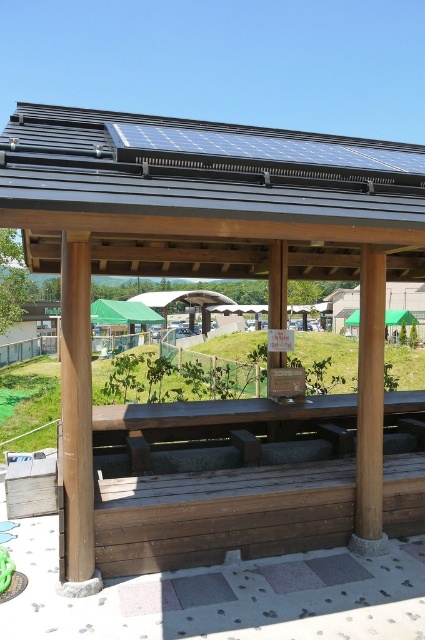
You are standing at the bus stop and want to check the distance between you and the black solar panel at upper center. Can you estimate if it is more than 3 meters?

The black solar panel at upper center is 3.01 meters from viewer, so yes, it is more than 3 meters away.

You are a maintenance worker checking the solar panels at the bus stop. You notice the black solar panel at upper center and the brown wood pillar at left. Which object is located above the other?

The black solar panel at upper center is positioned over brown wood pillar at left, meaning it is above the pillar.

You are a maintenance worker needing to reach both the black solar panel at upper center and the brown wood pillar at left. Which one is closer to you?

The brown wood pillar at left is closer to you since it is only 1.23 meters away from the black solar panel at upper center, but without knowing your exact position, we can only state their separation distance.